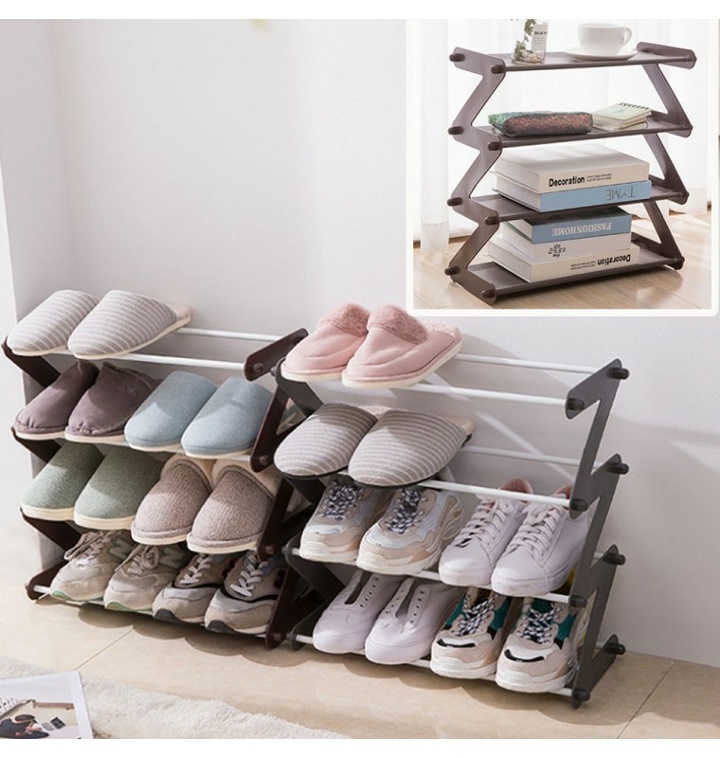
Image resolution: width=720 pixels, height=758 pixels. I want to click on books, so click(x=536, y=268), click(x=540, y=249), click(x=546, y=233), click(x=562, y=199), click(x=567, y=177).